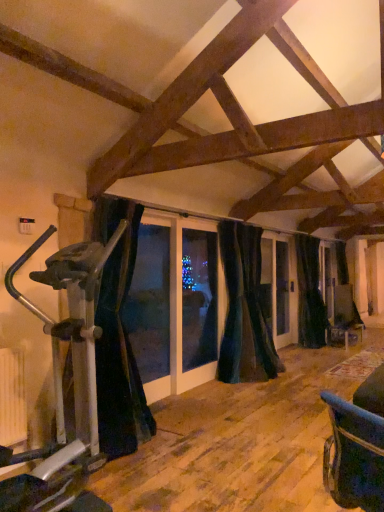
Question: In terms of height, does dark velvet curtain at center, the second curtain in the back-to-front sequence, look taller or shorter compared to silver metallic stationary bicycle at left?

Choices:
 (A) tall
 (B) short

Answer: (A)

Question: Is dark velvet curtain at center, the second curtain viewed from the front, in front of or behind silver metallic stationary bicycle at left in the image?

Choices:
 (A) front
 (B) behind

Answer: (B)

Question: Estimate the real-world distances between objects in this image. Which object is closer to the black velvet curtain at right, the first curtain positioned from the back?

Choices:
 (A) black fabric curtain at left, placed as the 1th curtain when sorted from left to right
 (B) silver metallic stationary bicycle at left
 (C) dark velvet curtain at center, the second curtain in the back-to-front sequence

Answer: (C)

Question: Which object is positioned farthest from the dark velvet curtain at center, the second curtain viewed from the left?

Choices:
 (A) silver metallic stationary bicycle at left
 (B) black velvet curtain at right, the third curtain when ordered from front to back
 (C) black fabric curtain at left, which appears as the first curtain when viewed from the front

Answer: (A)